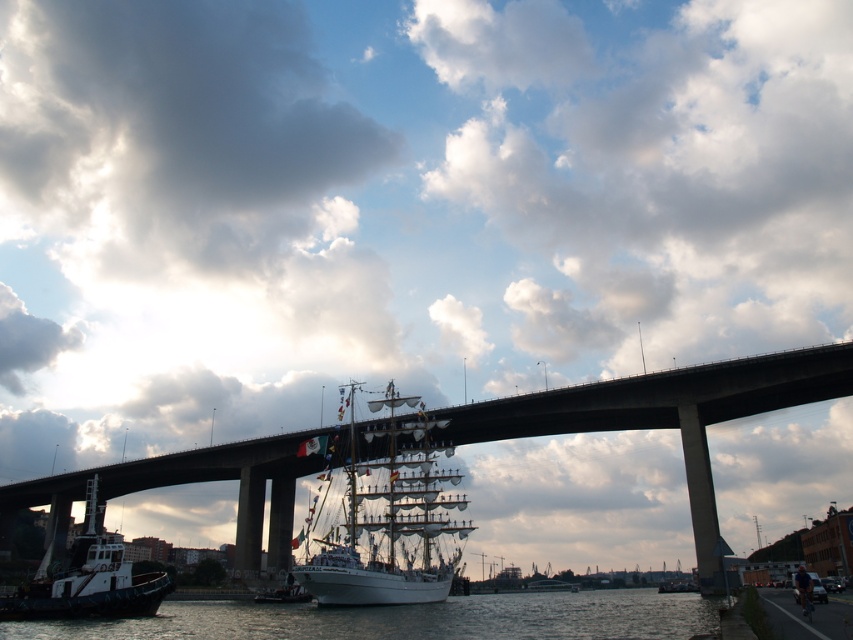
Question: Which of the following is the farthest from the observer?

Choices:
 (A) white matte tugboat at lower left
 (B) clear water at lower center
 (C) white wooden ship at center

Answer: (C)

Question: Which point is closer to the camera?

Choices:
 (A) (650, 609)
 (B) (396, 561)
 (C) (154, 605)
 (D) (68, 474)

Answer: (C)

Question: Which of these objects is positioned closest to the white wooden ship at center?

Choices:
 (A) concrete bridge at center
 (B) clear water at lower center

Answer: (A)

Question: Is clear water at lower center smaller than white matte tugboat at lower left?

Choices:
 (A) no
 (B) yes

Answer: (A)

Question: Does concrete bridge at center appear under white wooden ship at center?

Choices:
 (A) no
 (B) yes

Answer: (B)

Question: Can you confirm if white wooden ship at center is positioned to the left of clear water at lower center?

Choices:
 (A) no
 (B) yes

Answer: (B)